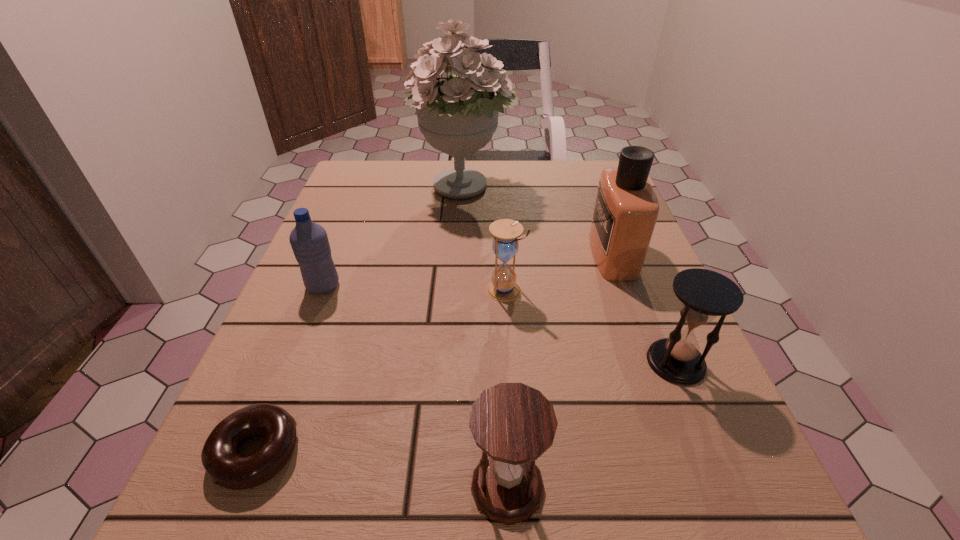
Where is `doughnut located in the near edge section of the desktop`? doughnut located in the near edge section of the desktop is located at coordinates (226, 468).

At what (x,y) coordinates should I click in order to perform the action: click on water bottle present at the left edge. Please return your answer as a coordinate pair (x, y). Looking at the image, I should click on (x=309, y=241).

This screenshot has width=960, height=540. What are the coordinates of `doughnut located in the left edge section of the desktop` in the screenshot? It's located at pyautogui.click(x=226, y=468).

Identify the location of perfume located in the right edge section of the desktop. (626, 209).

Locate an element on the screen. The height and width of the screenshot is (540, 960). hourglass that is at the right edge is located at coordinates (705, 294).

Find the location of `object located at the near left corner`. object located at the near left corner is located at coordinates (226, 468).

The image size is (960, 540). In order to click on vacant space at the far edge in this screenshot , I will do `click(411, 200)`.

At what (x,y) coordinates should I click in order to perform the action: click on free region at the near edge of the desktop. Please return your answer as a coordinate pair (x, y). This screenshot has height=540, width=960. Looking at the image, I should click on (413, 500).

Find the location of a particular element. Image resolution: width=960 pixels, height=540 pixels. vacant area at the left edge of the desktop is located at coordinates (303, 288).

Locate an element on the screen. vacant space at the right edge of the desktop is located at coordinates (588, 252).